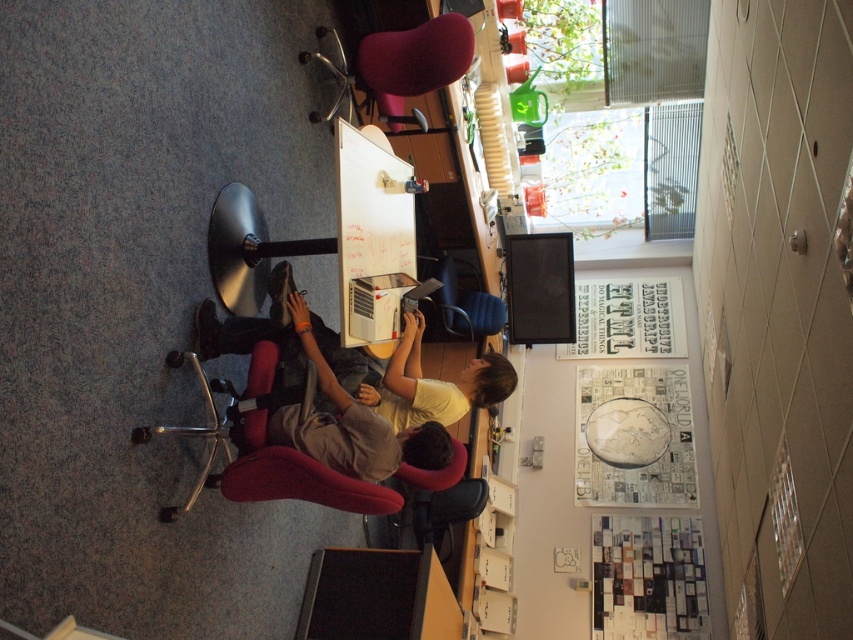
Question: Does velvet red swivel chair at upper center appear on the right side of blue fabric chair at center?

Choices:
 (A) no
 (B) yes

Answer: (A)

Question: Can you confirm if velvet red swivel chair at upper center is bigger than blue fabric chair at center?

Choices:
 (A) no
 (B) yes

Answer: (A)

Question: Among these points, which one is farthest from the camera?

Choices:
 (A) (369, 67)
 (B) (437, 291)

Answer: (B)

Question: Can you confirm if velvet red swivel chair at upper center is smaller than blue fabric chair at center?

Choices:
 (A) no
 (B) yes

Answer: (B)

Question: Among these objects, which one is farthest from the camera?

Choices:
 (A) velvet red swivel chair at upper center
 (B) blue fabric chair at center

Answer: (B)